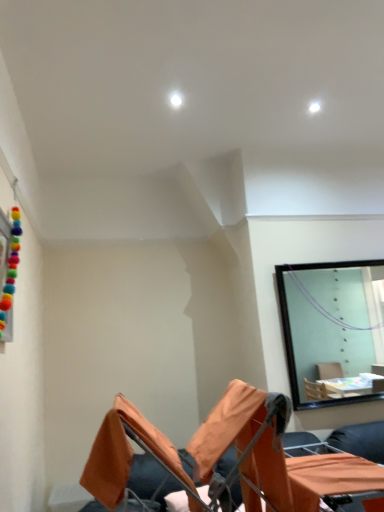
What do you see at coordinates (222, 455) in the screenshot? I see `orange fabric chair at lower center` at bounding box center [222, 455].

You are a GUI agent. You are given a task and a screenshot of the screen. Output one action in this format:
    pyautogui.click(x=<x>, y=<y>)
    Task: Click on the orange fabric chair at lower center
    
    Given the screenshot: What is the action you would take?
    pyautogui.click(x=222, y=455)

This screenshot has height=512, width=384. What are the coordinates of `orange fabric table at lower right` in the screenshot? It's located at (330, 477).

What do you see at coordinates (330, 477) in the screenshot? This screenshot has width=384, height=512. I see `orange fabric table at lower right` at bounding box center [330, 477].

Locate an element on the screen. The height and width of the screenshot is (512, 384). orange fabric chair at lower center is located at coordinates (222, 455).

In the scene shown: Would you say orange fabric table at lower right is to the left or to the right of orange fabric chair at lower center in the picture?

Based on their positions, orange fabric table at lower right is located to the right of orange fabric chair at lower center.

Is orange fabric table at lower right in front of or behind orange fabric chair at lower center in the image?

orange fabric table at lower right is behind orange fabric chair at lower center.

Does point (331, 490) appear closer or farther from the camera than point (302, 473)?

Point (331, 490) appears to be closer to the viewer than point (302, 473).

From the image's perspective, is orange fabric table at lower right positioned above or below orange fabric chair at lower center?

From the image's perspective, orange fabric table at lower right appears below orange fabric chair at lower center.

From a real-world perspective, is orange fabric table at lower right beneath orange fabric chair at lower center?

Indeed, from a real-world perspective, orange fabric table at lower right is positioned beneath orange fabric chair at lower center.

Is orange fabric table at lower right wider than orange fabric chair at lower center?

In fact, orange fabric table at lower right might be narrower than orange fabric chair at lower center.

In the scene shown: Considering the sizes of objects orange fabric table at lower right and orange fabric chair at lower center in the image provided, who is taller, orange fabric table at lower right or orange fabric chair at lower center?

orange fabric chair at lower center.

In terms of size, does orange fabric table at lower right appear bigger or smaller than orange fabric chair at lower center?

Clearly, orange fabric table at lower right is smaller in size than orange fabric chair at lower center.

Could orange fabric chair at lower center be considered to be inside orange fabric table at lower right?

No, orange fabric chair at lower center is not inside orange fabric table at lower right.

Is orange fabric table at lower right next to orange fabric chair at lower center?

No, orange fabric table at lower right is not beside orange fabric chair at lower center.

Is orange fabric table at lower right facing away from orange fabric chair at lower center?

Correct, orange fabric table at lower right is looking away from orange fabric chair at lower center.

Consider the image. Measure the distance between orange fabric table at lower right and orange fabric chair at lower center.

orange fabric table at lower right and orange fabric chair at lower center are 6.35 inches apart.

You are a GUI agent. You are given a task and a screenshot of the screen. Output one action in this format:
    pyautogui.click(x=<x>, y=<y>)
    Task: Click on the table behind the orange fabric chair at lower center
    Image resolution: width=384 pixels, height=512 pixels.
    Given the screenshot: What is the action you would take?
    pyautogui.click(x=330, y=477)

Considering the relative positions of orange fabric chair at lower center and orange fabric table at lower right in the image provided, is orange fabric chair at lower center to the right of orange fabric table at lower right from the viewer's perspective?

No.

In the image, is orange fabric chair at lower center positioned in front of or behind orange fabric table at lower right?

Visually, orange fabric chair at lower center is located in front of orange fabric table at lower right.

Considering the points (167, 473) and (305, 485), which point is behind, point (167, 473) or point (305, 485)?

The point (167, 473) is more distant.

From the image's perspective, which object appears higher, orange fabric chair at lower center or orange fabric table at lower right?

From the image's view, orange fabric chair at lower center is above.

From a real-world perspective, is orange fabric chair at lower center located beneath orange fabric table at lower right?

Actually, orange fabric chair at lower center is physically above orange fabric table at lower right in the real world.

Considering the sizes of orange fabric chair at lower center and orange fabric table at lower right in the image, is orange fabric chair at lower center wider or thinner than orange fabric table at lower right?

Clearly, orange fabric chair at lower center has more width compared to orange fabric table at lower right.

Considering the sizes of orange fabric chair at lower center and orange fabric table at lower right in the image, is orange fabric chair at lower center taller or shorter than orange fabric table at lower right?

orange fabric chair at lower center is taller than orange fabric table at lower right.

Considering the sizes of objects orange fabric chair at lower center and orange fabric table at lower right in the image provided, who is bigger, orange fabric chair at lower center or orange fabric table at lower right?

orange fabric chair at lower center.

Does orange fabric chair at lower center contain orange fabric table at lower right?

Indeed, orange fabric table at lower right is located within orange fabric chair at lower center.

Looking at this image, is orange fabric chair at lower center placed right next to orange fabric table at lower right?

No, orange fabric chair at lower center is not with orange fabric table at lower right.

Could you tell me if orange fabric chair at lower center is turned towards orange fabric table at lower right?

Yes, orange fabric chair at lower center is aimed at orange fabric table at lower right.

What's the angular difference between orange fabric chair at lower center and orange fabric table at lower right's facing directions?

There is a 0.00048-degree angle between the facing directions of orange fabric chair at lower center and orange fabric table at lower right.

Identify the location of furniture in front of the orange fabric table at lower right. (222, 455).

I want to click on furniture to the left of orange fabric table at lower right, so click(222, 455).

This screenshot has height=512, width=384. I want to click on furniture above the orange fabric table at lower right (from a real-world perspective), so click(x=222, y=455).